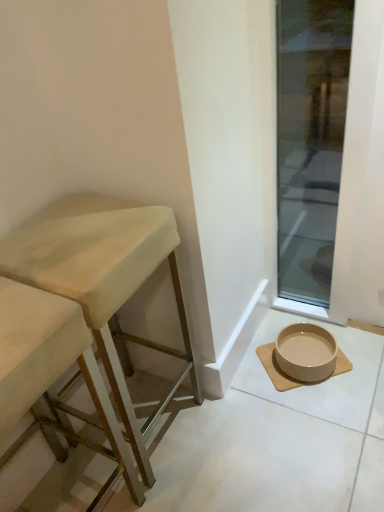
Question: Considering the relative sizes of wooden stool at left, marked as the second stool in a right-to-left arrangement, and beige ceramic bowl at lower right in the image provided, is wooden stool at left, marked as the second stool in a right-to-left arrangement, wider than beige ceramic bowl at lower right?

Choices:
 (A) no
 (B) yes

Answer: (B)

Question: Considering the relative sizes of wooden stool at left, which is the first stool in left-to-right order, and beige ceramic bowl at lower right in the image provided, is wooden stool at left, which is the first stool in left-to-right order, smaller than beige ceramic bowl at lower right?

Choices:
 (A) no
 (B) yes

Answer: (A)

Question: Can you confirm if wooden stool at left, which is the first stool in left-to-right order, is shorter than beige ceramic bowl at lower right?

Choices:
 (A) yes
 (B) no

Answer: (B)

Question: From a real-world perspective, is wooden stool at left, which is the first stool in left-to-right order, under beige ceramic bowl at lower right?

Choices:
 (A) no
 (B) yes

Answer: (A)

Question: Is wooden stool at left, which is the first stool in left-to-right order, further to the viewer compared to beige ceramic bowl at lower right?

Choices:
 (A) no
 (B) yes

Answer: (A)

Question: From the image's perspective, would you say wooden stool at left, marked as the second stool in a right-to-left arrangement, is positioned over beige ceramic bowl at lower right?

Choices:
 (A) yes
 (B) no

Answer: (B)

Question: Can you confirm if beige ceramic bowl at lower right is taller than wooden stool at left, marked as the second stool in a right-to-left arrangement?

Choices:
 (A) no
 (B) yes

Answer: (A)

Question: Is beige ceramic bowl at lower right facing towards wooden stool at left, marked as the second stool in a right-to-left arrangement?

Choices:
 (A) no
 (B) yes

Answer: (A)

Question: Considering the relative sizes of beige ceramic bowl at lower right and wooden stool at left, which is the first stool in left-to-right order, in the image provided, is beige ceramic bowl at lower right thinner than wooden stool at left, which is the first stool in left-to-right order,?

Choices:
 (A) yes
 (B) no

Answer: (A)

Question: Does beige ceramic bowl at lower right have a lesser height compared to wooden stool at left, which is the first stool in left-to-right order?

Choices:
 (A) yes
 (B) no

Answer: (A)

Question: Can we say beige ceramic bowl at lower right lies outside wooden stool at left, marked as the second stool in a right-to-left arrangement?

Choices:
 (A) yes
 (B) no

Answer: (A)

Question: Does beige ceramic bowl at lower right appear on the left side of wooden stool at left, marked as the second stool in a right-to-left arrangement?

Choices:
 (A) yes
 (B) no

Answer: (B)

Question: Is the position of transparent glass door at lower right less distant than that of beige fabric stool at left, the 2th stool positioned from the left?

Choices:
 (A) yes
 (B) no

Answer: (B)